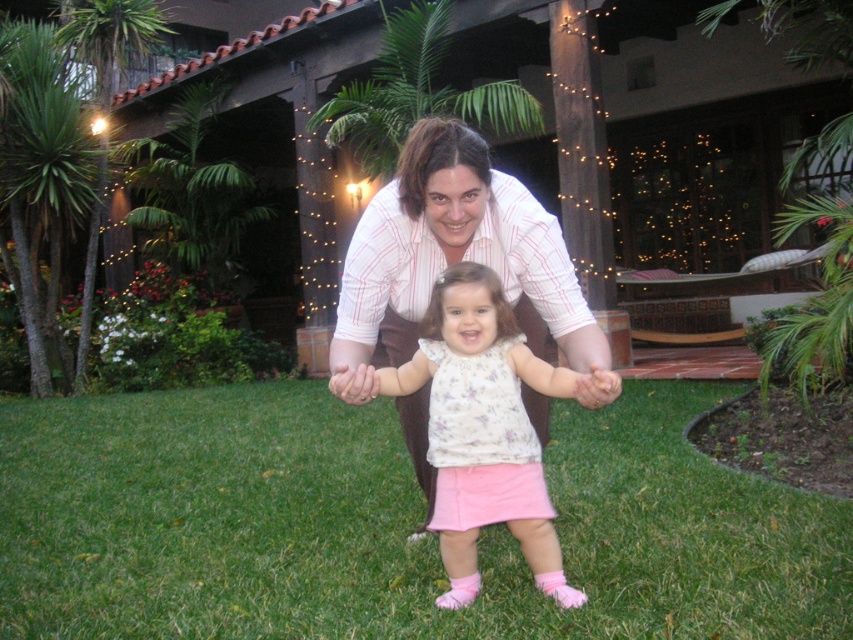
Does green grass at center have a smaller size compared to light pink cotton dress at center?

Yes.

Measure the distance between point (x=703, y=467) and camera.

They are 14.02 feet apart.

Where is `green grass at center`? The image size is (853, 640). green grass at center is located at coordinates (387, 524).